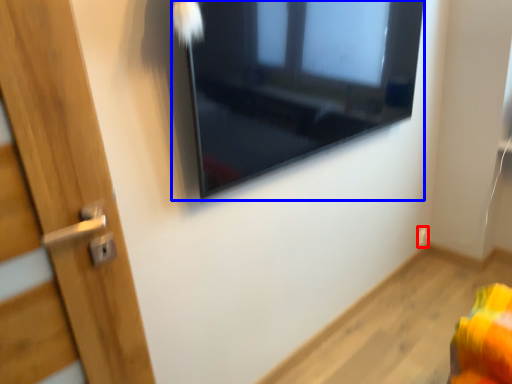
Question: Which object appears closest to the camera in this image, electric outlet (highlighted by a red box) or window (highlighted by a blue box)?

Choices:
 (A) electric outlet
 (B) window

Answer: (B)